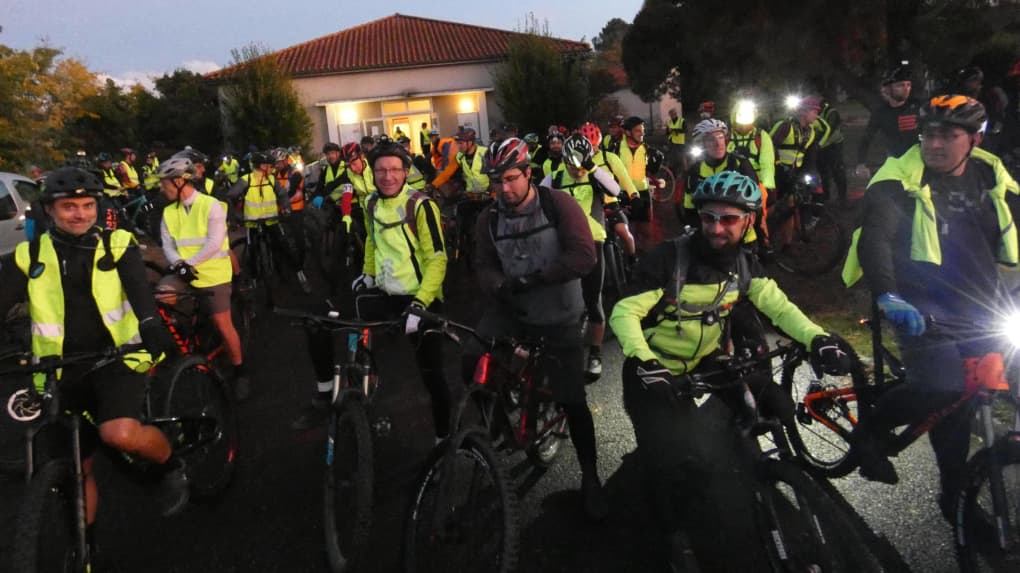
Where is `lights`? Image resolution: width=1020 pixels, height=573 pixels. lights is located at coordinates (1006, 325), (814, 176), (691, 156), (760, 109), (799, 105), (285, 162).